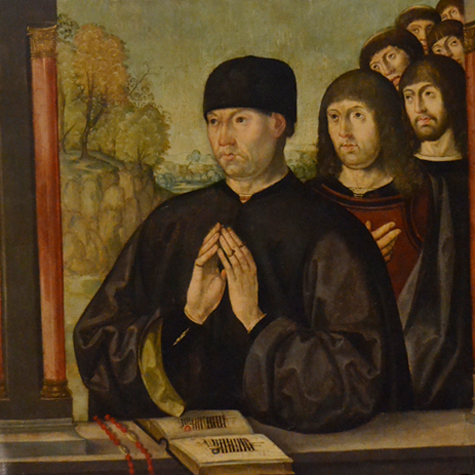
The width and height of the screenshot is (475, 475). I want to click on robes, so click(x=291, y=246), click(x=430, y=233), click(x=458, y=178).